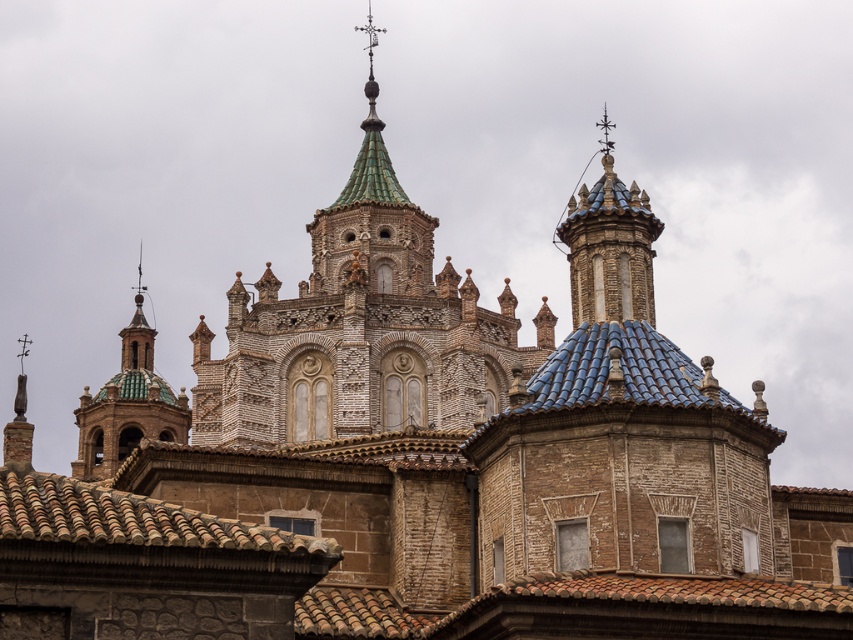
Question: Which of the following is the closest to the observer?

Choices:
 (A) green glazed tile tower at center
 (B) blue glazed tiles at upper center
 (C) green glazed tile dome at upper left

Answer: (A)

Question: Is blue glazed tiles at upper center thinner than green glazed tile dome at upper left?

Choices:
 (A) yes
 (B) no

Answer: (A)

Question: Among these points, which one is farthest from the camera?

Choices:
 (A) (602, 253)
 (B) (320, 262)

Answer: (B)

Question: Is green glazed tile tower at center in front of blue glazed tiles at upper center?

Choices:
 (A) yes
 (B) no

Answer: (A)

Question: Does green glazed tile tower at center have a larger size compared to green glazed tile dome at upper left?

Choices:
 (A) yes
 (B) no

Answer: (A)

Question: Which of the following is the farthest from the observer?

Choices:
 (A) green glazed tile dome at upper left
 (B) green glazed tile tower at center

Answer: (A)